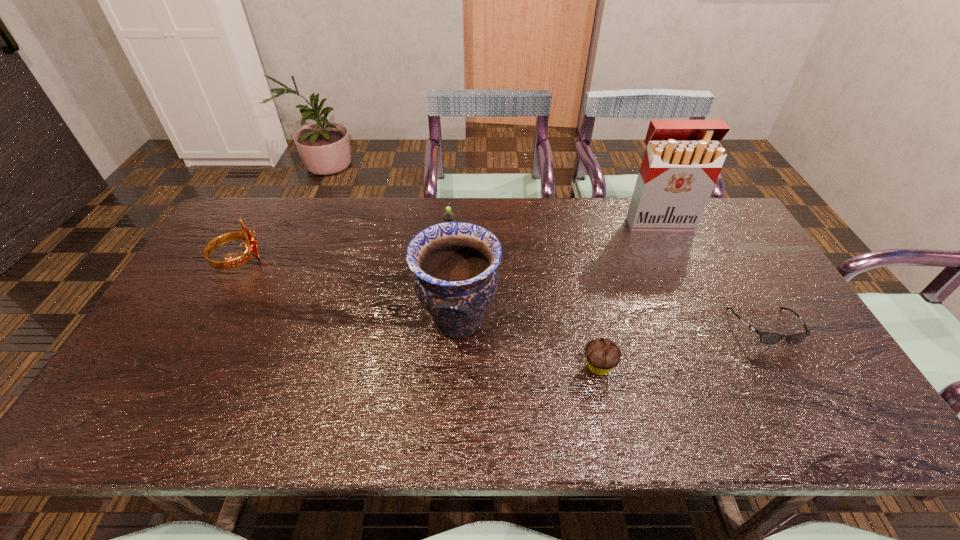
The image size is (960, 540). In order to click on blank space located 0.240m on the front handle of the pottery in this screenshot , I will do `click(588, 320)`.

You are a GUI agent. You are given a task and a screenshot of the screen. Output one action in this format:
    pyautogui.click(x=<x>, y=<y>)
    Task: Click on the vacant space located 0.170m on the front-facing side of the third tallest object
    
    Given the screenshot: What is the action you would take?
    pyautogui.click(x=319, y=260)

Where is `vacant space situated on the front label of the fourth tallest object`? Image resolution: width=960 pixels, height=540 pixels. vacant space situated on the front label of the fourth tallest object is located at coordinates (444, 332).

Locate an element on the screen. The image size is (960, 540). free space located on the front of the third object from right to left is located at coordinates (613, 433).

Locate an element on the screen. vacant region located 0.210m on the front-facing side of the sunglasses is located at coordinates (823, 428).

You are a GUI agent. You are given a task and a screenshot of the screen. Output one action in this format:
    pyautogui.click(x=<x>, y=<y>)
    Task: Click on the cigarette case positioned at the far edge
    The height and width of the screenshot is (540, 960).
    Given the screenshot: What is the action you would take?
    pyautogui.click(x=682, y=161)

This screenshot has width=960, height=540. Find the location of `soda that is at the far edge`. soda that is at the far edge is located at coordinates (448, 216).

Image resolution: width=960 pixels, height=540 pixels. I want to click on object that is at the left edge, so click(251, 250).

Locate an element on the screen. cigarette case at the right edge is located at coordinates (682, 161).

Locate an element on the screen. This screenshot has height=540, width=960. sunglasses that is at the right edge is located at coordinates (768, 338).